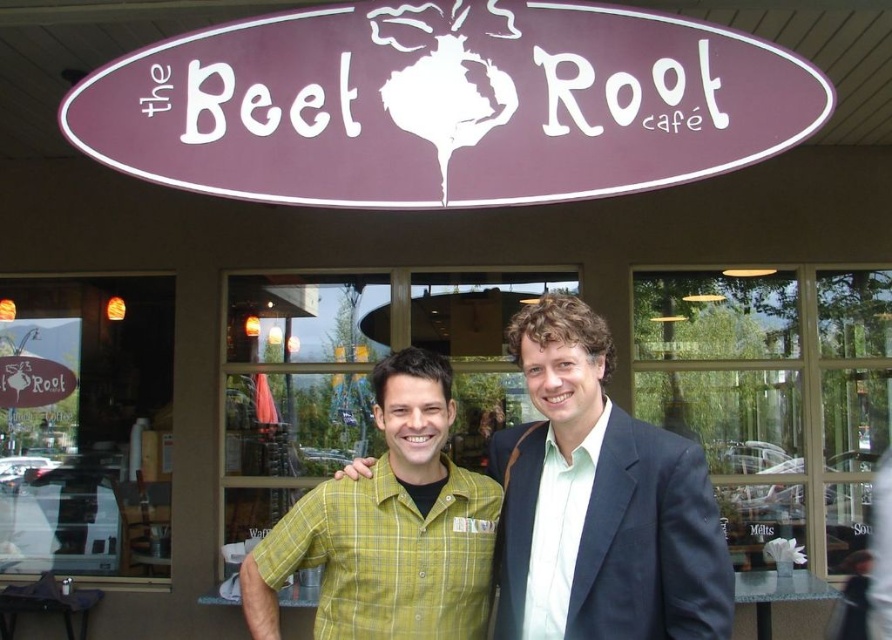
Question: Is dark blue suit at center wider than yellow plaid shirt at center?

Choices:
 (A) yes
 (B) no

Answer: (B)

Question: Among these points, which one is nearest to the camera?

Choices:
 (A) (651, 504)
 (B) (446, 605)

Answer: (A)

Question: Is dark blue suit at center above yellow plaid shirt at center?

Choices:
 (A) no
 (B) yes

Answer: (B)

Question: Can you confirm if dark blue suit at center is smaller than yellow plaid shirt at center?

Choices:
 (A) no
 (B) yes

Answer: (A)

Question: Which point appears closest to the camera in this image?

Choices:
 (A) (643, 541)
 (B) (369, 518)

Answer: (A)